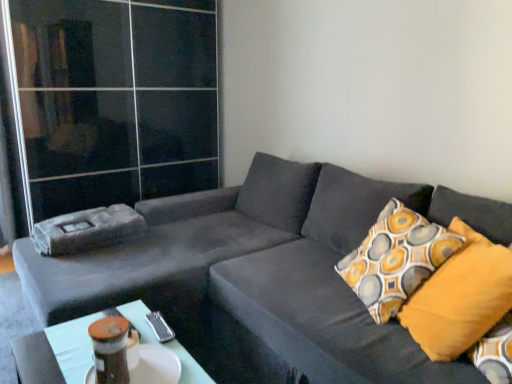
Question: Can you confirm if mustard yellow fabric pillow at right is shorter than velvet gray couch at center?

Choices:
 (A) no
 (B) yes

Answer: (B)

Question: Considering the relative positions of mustard yellow fabric pillow at right and velvet gray couch at center in the image provided, is mustard yellow fabric pillow at right behind velvet gray couch at center?

Choices:
 (A) yes
 (B) no

Answer: (A)

Question: Does mustard yellow fabric pillow at right have a greater width compared to velvet gray couch at center?

Choices:
 (A) no
 (B) yes

Answer: (A)

Question: From a real-world perspective, is mustard yellow fabric pillow at right over velvet gray couch at center?

Choices:
 (A) no
 (B) yes

Answer: (B)

Question: Does mustard yellow fabric pillow at right have a lesser width compared to velvet gray couch at center?

Choices:
 (A) no
 (B) yes

Answer: (B)

Question: From the image's perspective, is mustard yellow fabric pillow at right above velvet gray couch at center?

Choices:
 (A) no
 (B) yes

Answer: (B)

Question: Can you confirm if velvet gray couch at center is smaller than transparent glass door at upper left?

Choices:
 (A) no
 (B) yes

Answer: (A)

Question: Is velvet gray couch at center in contact with transparent glass door at upper left?

Choices:
 (A) yes
 (B) no

Answer: (B)

Question: Is velvet gray couch at center bigger than transparent glass door at upper left?

Choices:
 (A) no
 (B) yes

Answer: (B)

Question: Does velvet gray couch at center have a lesser width compared to transparent glass door at upper left?

Choices:
 (A) no
 (B) yes

Answer: (A)

Question: Does velvet gray couch at center appear on the left side of transparent glass door at upper left?

Choices:
 (A) no
 (B) yes

Answer: (A)

Question: Is velvet gray couch at center turned away from transparent glass door at upper left?

Choices:
 (A) no
 (B) yes

Answer: (A)

Question: Is matte plastic table at lower center positioned before mustard yellow fabric pillow at right?

Choices:
 (A) yes
 (B) no

Answer: (A)